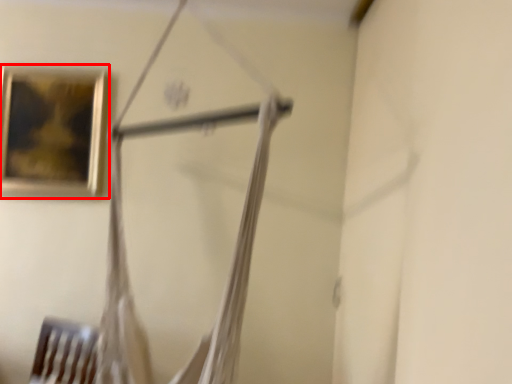
Question: Where is picture frame (annotated by the red box) located in relation to hanger in the image?

Choices:
 (A) right
 (B) left

Answer: (B)